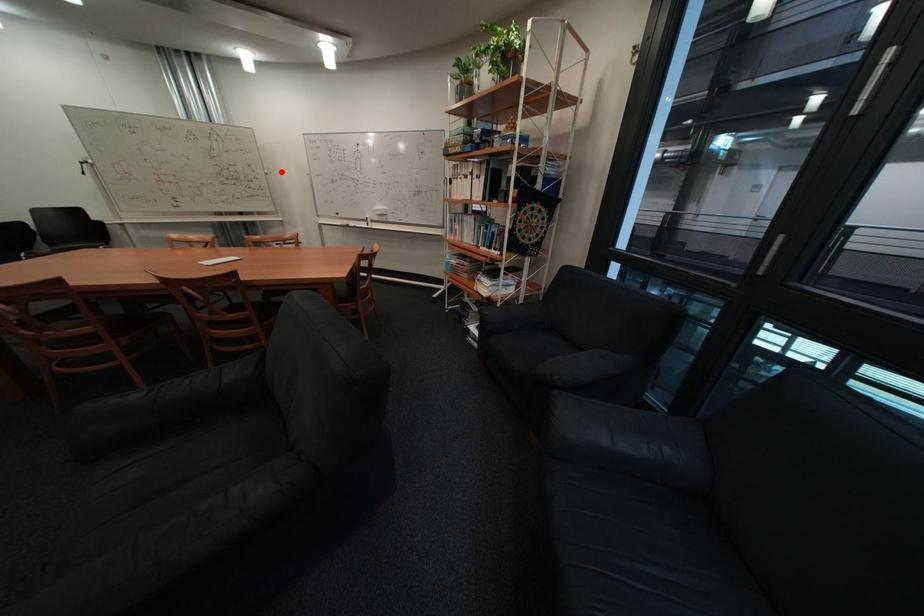
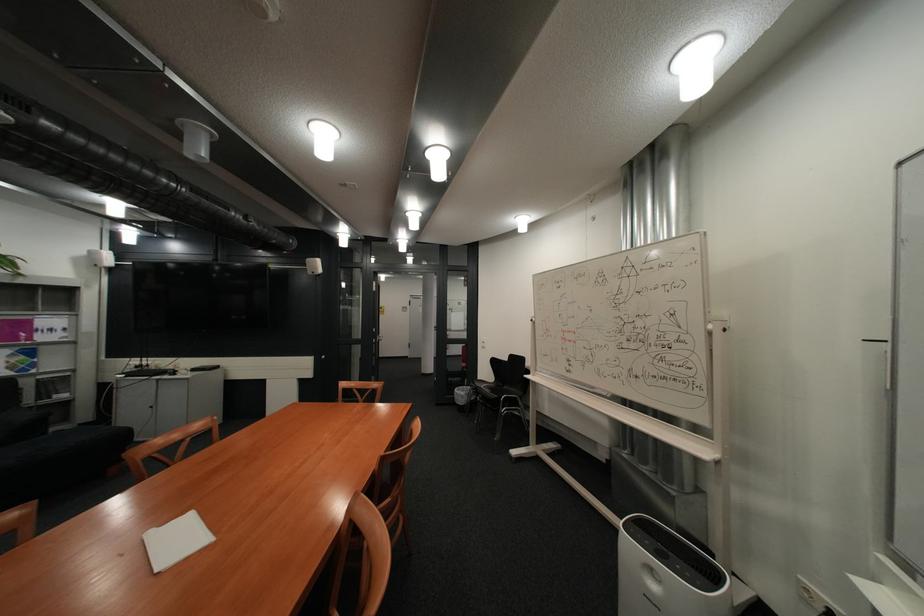
Question: I am providing you with two images of the same scene from different viewpoints. Image1 has a red point marked. In image2, the corresponding 3D location appears at what relative position? Reply with the corresponding letter.

Choices:
 (A) Closer
 (B) Farther

Answer: (B)